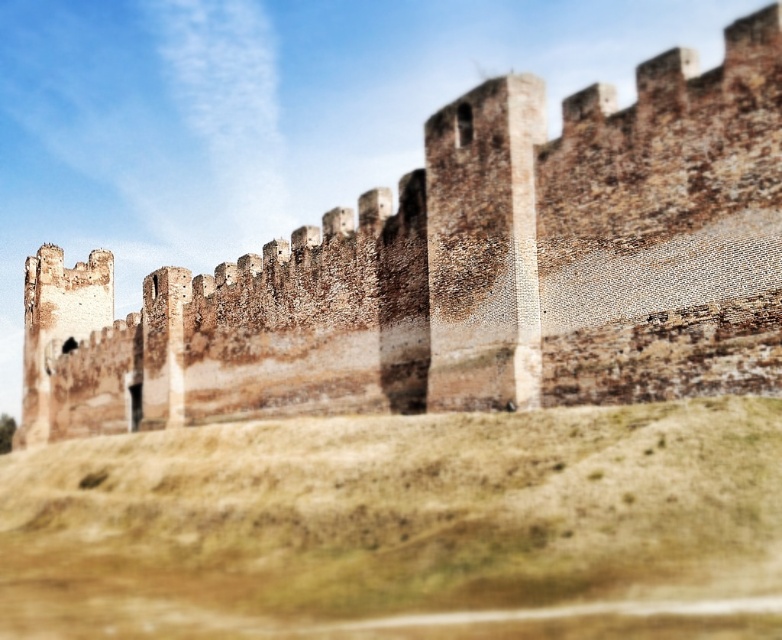
You are standing in front of the historic stone wall and want to walk towards the brown grassy hill at lower center. Which direction should you move relative to the brown stone wall at center?

You should move away from the brown stone wall at center towards the brown grassy hill at lower center since the wall is closer to you than the hill.

Based on the photo, you are an architect designing a new garden pathway. You need to decide whether to place the pathway along the brown stone wall at center or the brown grassy hill at lower center. Based on their widths, which location would allow for a wider pathway?

The brown stone wall at center is wider than the brown grassy hill at lower center, so placing the pathway along the brown stone wall at center would allow for a wider pathway.